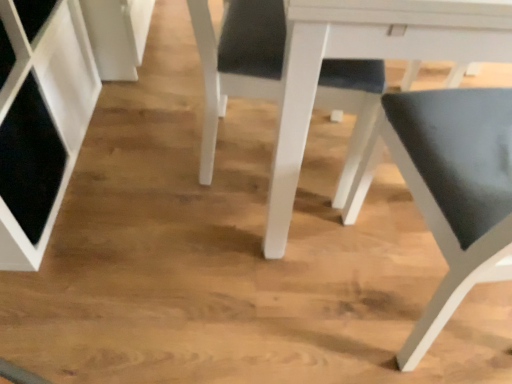
Question: Is matte black chair at center, the first chair positioned from the left, far away from matte black chair at lower right, the second chair viewed from the left?

Choices:
 (A) yes
 (B) no

Answer: (B)

Question: From the image's perspective, does matte black chair at center, arranged as the second chair when viewed from the right, appear lower than matte black chair at lower right, the second chair viewed from the left?

Choices:
 (A) yes
 (B) no

Answer: (B)

Question: Can you confirm if matte black chair at center, the first chair positioned from the left, is smaller than matte black chair at lower right, the second chair viewed from the left?

Choices:
 (A) yes
 (B) no

Answer: (A)

Question: Does matte black chair at center, the first chair positioned from the left, contain matte black chair at lower right, the second chair viewed from the left?

Choices:
 (A) no
 (B) yes

Answer: (A)

Question: Is matte black chair at center, the first chair positioned from the left, aimed at matte black chair at lower right, the second chair viewed from the left?

Choices:
 (A) no
 (B) yes

Answer: (A)

Question: Can you confirm if matte black chair at center, arranged as the second chair when viewed from the right, is wider than matte black chair at lower right, the second chair viewed from the left?

Choices:
 (A) no
 (B) yes

Answer: (A)

Question: Is matte black chair at lower right, the second chair viewed from the left, facing away from matte black chair at center, the first chair positioned from the left?

Choices:
 (A) no
 (B) yes

Answer: (A)

Question: Considering the relative sizes of matte black chair at lower right, the second chair viewed from the left, and matte black chair at center, the first chair positioned from the left, in the image provided, is matte black chair at lower right, the second chair viewed from the left, taller than matte black chair at center, the first chair positioned from the left,?

Choices:
 (A) no
 (B) yes

Answer: (B)

Question: Is matte black chair at lower right, the second chair viewed from the left, further to the viewer compared to matte black chair at center, arranged as the second chair when viewed from the right?

Choices:
 (A) no
 (B) yes

Answer: (A)

Question: Is matte black chair at lower right, which ranks as the first chair in right-to-left order, to the right of matte black chair at center, the first chair positioned from the left, from the viewer's perspective?

Choices:
 (A) yes
 (B) no

Answer: (A)

Question: Can you confirm if matte black chair at lower right, which ranks as the first chair in right-to-left order, is wider than matte black chair at center, the first chair positioned from the left?

Choices:
 (A) yes
 (B) no

Answer: (A)

Question: Is matte black chair at lower right, the second chair viewed from the left, positioned beyond the bounds of matte black chair at center, arranged as the second chair when viewed from the right?

Choices:
 (A) no
 (B) yes

Answer: (B)

Question: From a real-world perspective, does matte black chair at center, the first chair positioned from the left, stand above white glossy table at center?

Choices:
 (A) yes
 (B) no

Answer: (B)